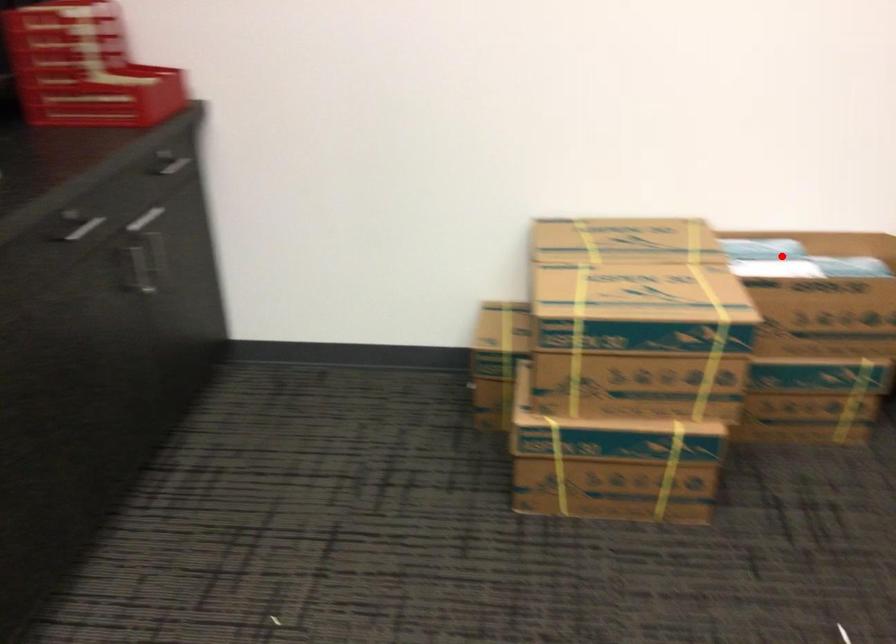
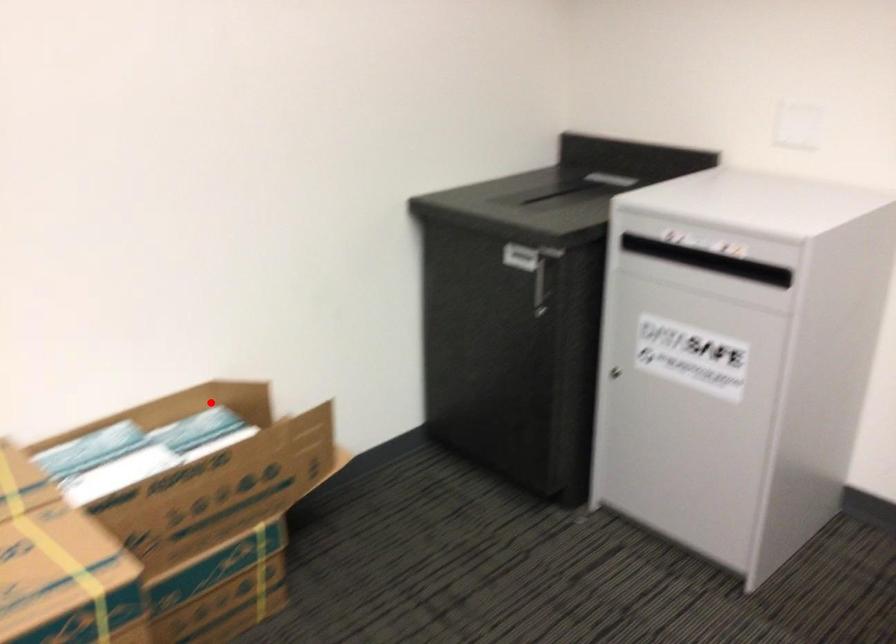
I am providing you with two images of the same scene from different viewpoints. A red point is marked on the first image and another point is marked on the second image. Is the marked point in image1 the same physical position as the marked point in image2?

No